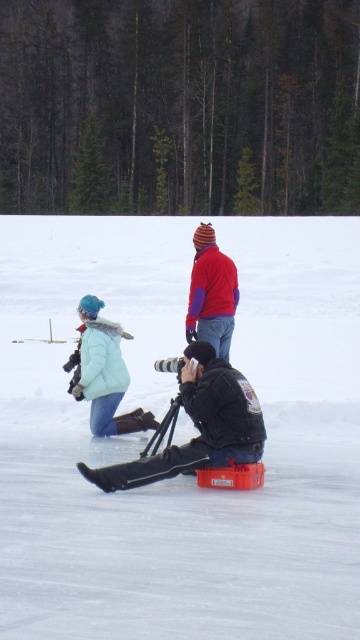
In the scene shown: Does orange plastic container at center appear on the right side of black matte tripod at center?

Correct, you'll find orange plastic container at center to the right of black matte tripod at center.

Is orange plastic container at center to the left of black matte tripod at center from the viewer's perspective?

In fact, orange plastic container at center is to the right of black matte tripod at center.

Which is in front, point (60, 627) or point (168, 419)?

Point (60, 627)

Where is `orange plastic container at center`? Image resolution: width=360 pixels, height=640 pixels. orange plastic container at center is located at coordinates (159, 419).

The image size is (360, 640). Describe the element at coordinates (159, 419) in the screenshot. I see `orange plastic container at center` at that location.

Is orange plastic container at center behind red woolen hat at upper center?

No, orange plastic container at center is closer to the viewer.

Is point (326, 538) farther from viewer compared to point (201, 280)?

No.

This screenshot has width=360, height=640. What are the coordinates of `orange plastic container at center` in the screenshot? It's located at (159, 419).

Is point (147, 481) behind point (160, 424)?

That is False.

From the picture: Who is more distant from viewer, (213,412) or (163,419)?

Positioned behind is point (163,419).

Does point (219, 433) come farther from viewer compared to point (155, 448)?

No.

Locate an element on the screen. The image size is (360, 640). dark blue leather jacket at lower center is located at coordinates (196, 426).